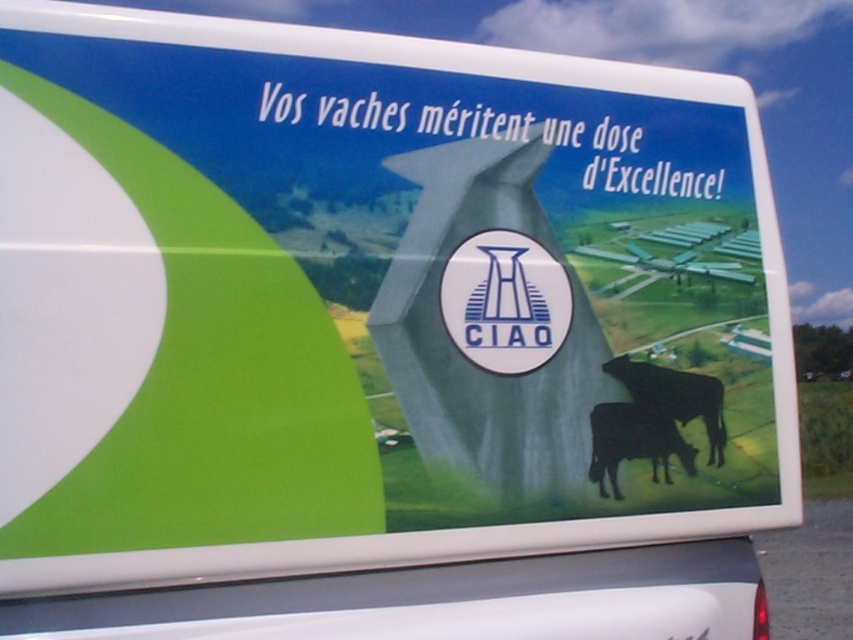
Question: Can you confirm if black glossy bull at lower right is smaller than black matte bull at lower right?

Choices:
 (A) yes
 (B) no

Answer: (A)

Question: In this image, where is black glossy bull at lower right located relative to black matte bull at lower right?

Choices:
 (A) below
 (B) above

Answer: (A)

Question: Is black glossy bull at lower right positioned at the back of black matte bull at lower right?

Choices:
 (A) yes
 (B) no

Answer: (B)